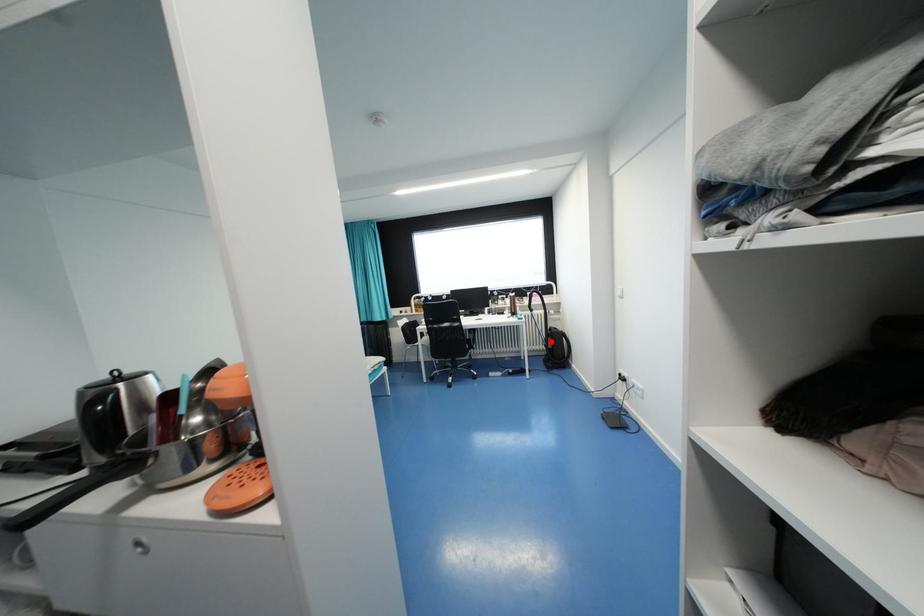
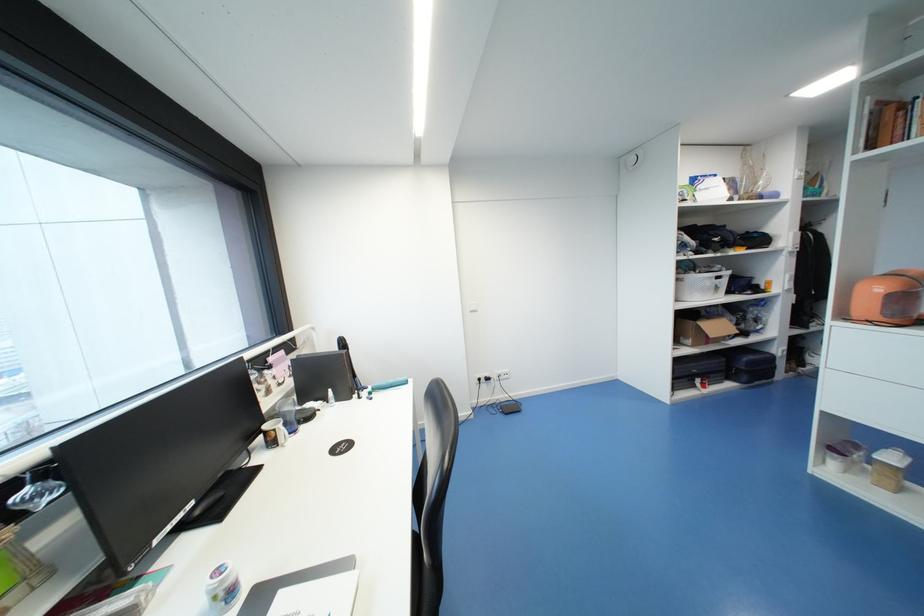
Question: I am providing you with two images of the same scene from different viewpoints. A red point is marked on the first image. At the location where the point appears in image 1, is it still visible in image 2?

Choices:
 (A) Yes
 (B) No

Answer: (B)